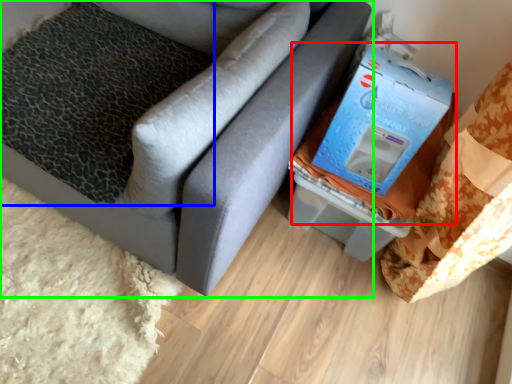
Question: Based on their relative distances, which object is farther from storage box (highlighted by a red box)? Choose from pillow (highlighted by a blue box) and furniture (highlighted by a green box).

Choices:
 (A) pillow
 (B) furniture

Answer: (A)